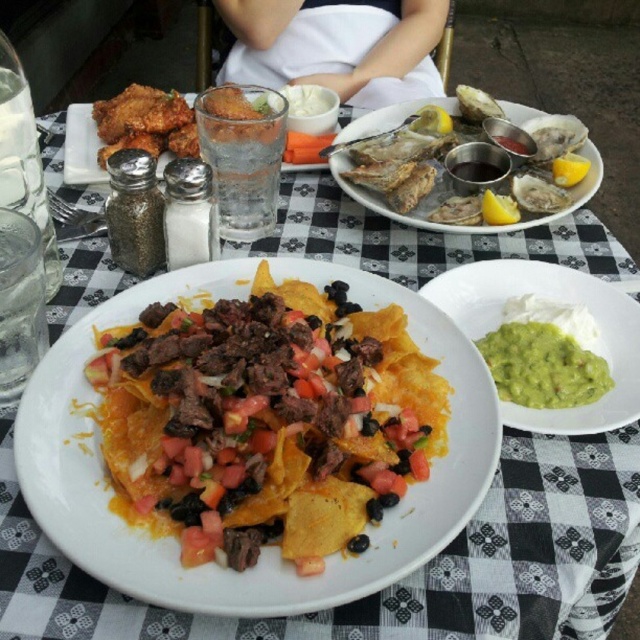
Is crunchy tortilla chips with cheese, meat, tomatoes, and black beans at center further to the viewer compared to shiny silver oysters at upper right?

No, crunchy tortilla chips with cheese, meat, tomatoes, and black beans at center is in front of shiny silver oysters at upper right.

Does crunchy tortilla chips with cheese, meat, tomatoes, and black beans at center come in front of shiny silver oysters at upper right?

Yes, crunchy tortilla chips with cheese, meat, tomatoes, and black beans at center is in front of shiny silver oysters at upper right.

What do you see at coordinates (266, 420) in the screenshot? The width and height of the screenshot is (640, 640). I see `crunchy tortilla chips with cheese, meat, tomatoes, and black beans at center` at bounding box center [266, 420].

The height and width of the screenshot is (640, 640). Identify the location of crunchy tortilla chips with cheese, meat, tomatoes, and black beans at center. (266, 420).

Describe the element at coordinates (266, 420) in the screenshot. I see `crunchy tortilla chips with cheese, meat, tomatoes, and black beans at center` at that location.

Which is in front, point (224, 481) or point (524, 378)?

Positioned in front is point (224, 481).

Which is behind, point (212, 432) or point (572, 355)?

Point (572, 355)

In order to click on crunchy tortilla chips with cheese, meat, tomatoes, and black beans at center in this screenshot , I will do `click(266, 420)`.

Looking at this image, does green creamy guacamole at right have a lesser width compared to shiny silver oysters at upper right?

Correct, green creamy guacamole at right's width is less than shiny silver oysters at upper right's.

Who is shorter, green creamy guacamole at right or shiny silver oysters at upper right?

green creamy guacamole at right is shorter.

Where is `green creamy guacamole at right`? The width and height of the screenshot is (640, 640). green creamy guacamole at right is located at coordinates pos(541,365).

The height and width of the screenshot is (640, 640). What are the coordinates of `green creamy guacamole at right` in the screenshot? It's located at (541, 365).